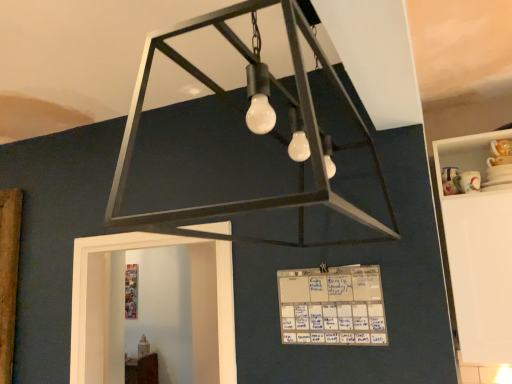
Question: Is the depth of white glossy cabinet at right greater than that of white paper calendar at center?

Choices:
 (A) yes
 (B) no

Answer: (A)

Question: Is white glossy cabinet at right not within white paper calendar at center?

Choices:
 (A) yes
 (B) no

Answer: (A)

Question: Is white glossy cabinet at right shorter than white paper calendar at center?

Choices:
 (A) no
 (B) yes

Answer: (A)

Question: Considering the relative sizes of white glossy cabinet at right and white paper calendar at center in the image provided, is white glossy cabinet at right bigger than white paper calendar at center?

Choices:
 (A) no
 (B) yes

Answer: (B)

Question: Is white paper calendar at center at the back of white glossy cabinet at right?

Choices:
 (A) no
 (B) yes

Answer: (A)

Question: Considering the positions of matte black chandelier at center and white paper calendar at center in the image, is matte black chandelier at center wider or thinner than white paper calendar at center?

Choices:
 (A) wide
 (B) thin

Answer: (A)

Question: Considering their positions, is matte black chandelier at center located in front of or behind white paper calendar at center?

Choices:
 (A) behind
 (B) front

Answer: (B)

Question: From a real-world perspective, is matte black chandelier at center positioned above or below white paper calendar at center?

Choices:
 (A) above
 (B) below

Answer: (A)

Question: From the image's perspective, is matte black chandelier at center located above or below white paper calendar at center?

Choices:
 (A) above
 (B) below

Answer: (A)

Question: Is white glossy cabinet at right spatially inside white paper calendar at center, or outside of it?

Choices:
 (A) inside
 (B) outside

Answer: (B)

Question: In the image, is white glossy cabinet at right positioned in front of or behind white paper calendar at center?

Choices:
 (A) front
 (B) behind

Answer: (B)

Question: Considering the positions of white glossy cabinet at right and white paper calendar at center in the image, is white glossy cabinet at right taller or shorter than white paper calendar at center?

Choices:
 (A) short
 (B) tall

Answer: (B)

Question: Is point (451, 279) positioned closer to the camera than point (298, 269)?

Choices:
 (A) farther
 (B) closer

Answer: (A)

Question: Looking at their shapes, would you say matte black chandelier at center is wider or thinner than white glossy cabinet at right?

Choices:
 (A) wide
 (B) thin

Answer: (A)

Question: Does point (330, 198) appear closer or farther from the camera than point (472, 301)?

Choices:
 (A) farther
 (B) closer

Answer: (B)